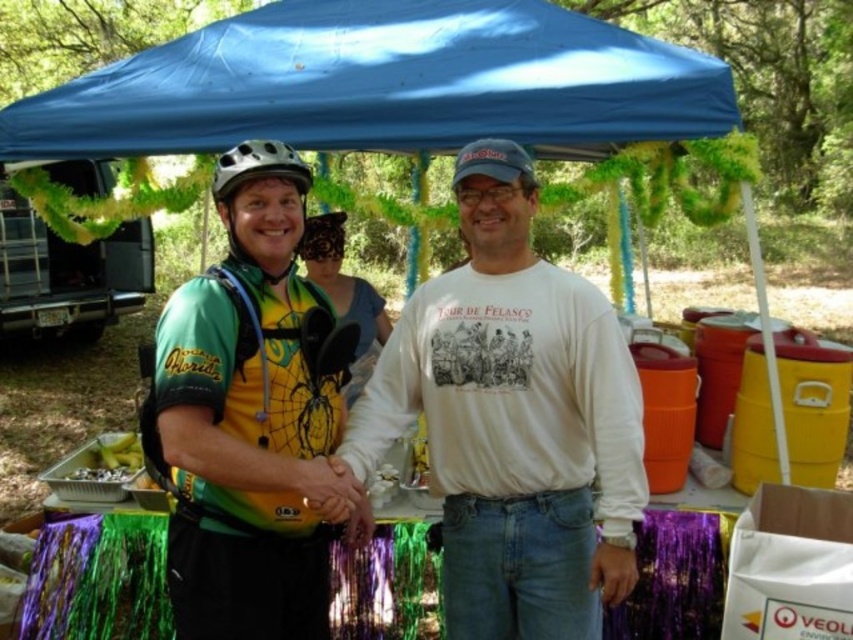
From the picture: You are organizing a photo shoot and need to ensure that the white cotton shirt at center and the matte black helmet at center fit within a rectangular frame. The frame can only accommodate items up to the width of the wider object. Which object determines the minimum required frame width?

The white cotton shirt at center determines the minimum required frame width because its width surpasses that of the matte black helmet at center, so the frame must be at least as wide as the white cotton shirt at center to accommodate both items.

What is the spatial relationship between the white cotton shirt at center and the blue fabric canopy at upper center in the scene?

The white cotton shirt at center is in front of the blue fabric canopy at upper center.